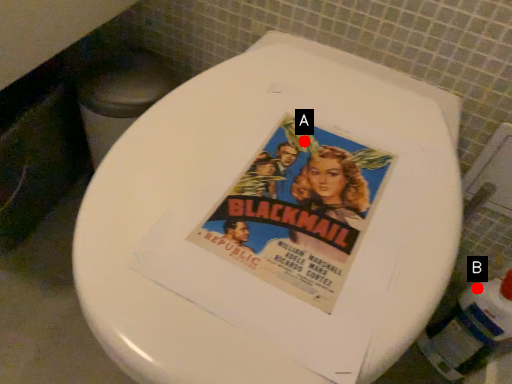
Question: Two points are circled on the image, labeled by A and B beside each circle. Among these points, which one is nearest to the camera?

Choices:
 (A) A is closer
 (B) B is closer

Answer: (A)